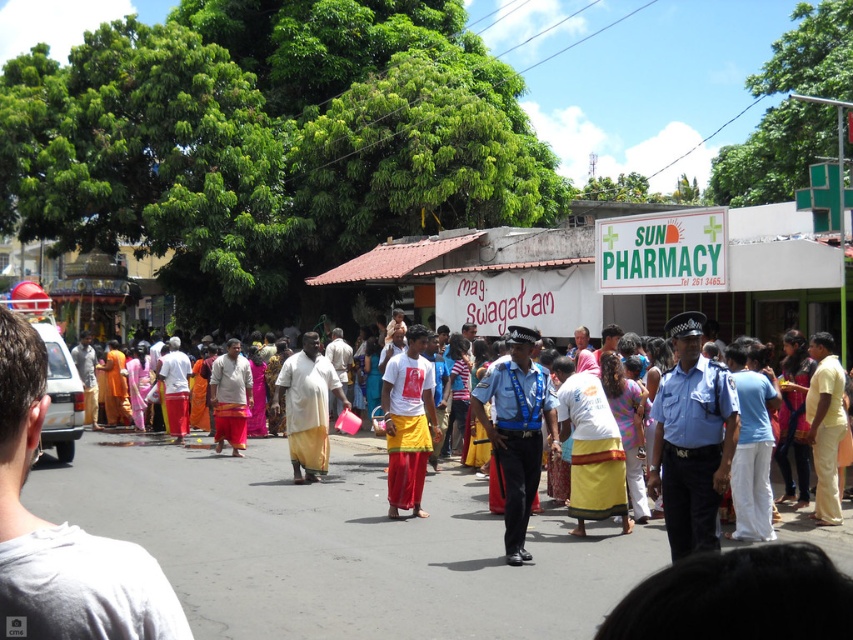
You are a photographer positioned at the center of the street scene. You want to take a photo that includes both the point at coordinates point (451, 566) and point (697, 509). Which point should you focus on first to ensure both are in sharp focus?

You should focus on point (451, 566) first because it is closer to you than point (697, 509). This ensures the closer point is in focus, and the farther point will also be within the depth of field.